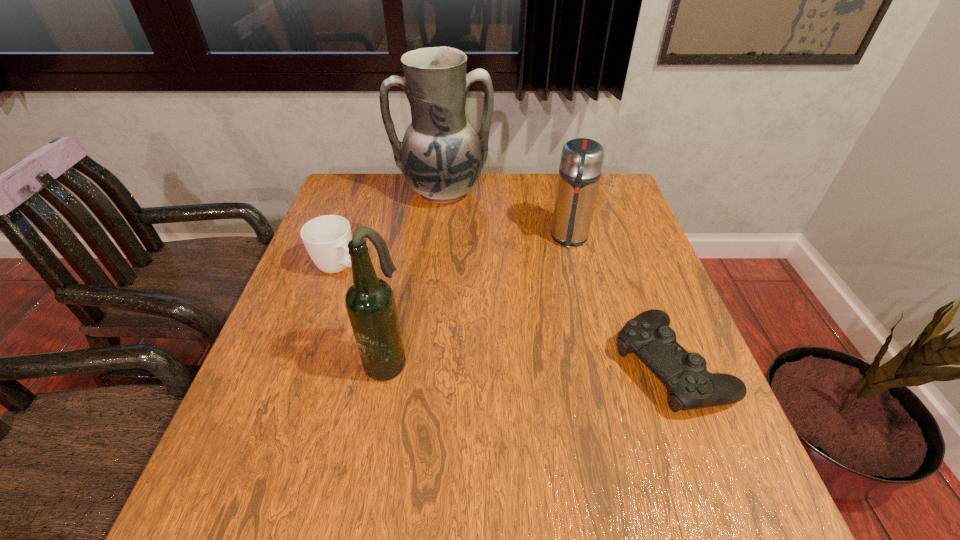
What are the coordinates of `object positioned at the left edge` in the screenshot? It's located at (x=326, y=238).

Where is `control positioned at the right edge`? The image size is (960, 540). control positioned at the right edge is located at coordinates (x=648, y=335).

Find the location of `thermos bottle that is at the right edge`. thermos bottle that is at the right edge is located at coordinates (581, 163).

Image resolution: width=960 pixels, height=540 pixels. I want to click on object that is at the near right corner, so click(x=648, y=335).

In the image, there is a desktop. Where is `vacant space at the far edge`? vacant space at the far edge is located at coordinates (414, 202).

This screenshot has height=540, width=960. Identify the location of vacant space at the near edge of the desktop. (332, 413).

Locate an element on the screen. The height and width of the screenshot is (540, 960). blank space at the left edge of the desktop is located at coordinates (343, 327).

Image resolution: width=960 pixels, height=540 pixels. In the image, there is a desktop. In order to click on vacant space at the right edge in this screenshot , I will do `click(618, 235)`.

I want to click on blank space at the far left corner, so click(x=386, y=178).

In the image, there is a desktop. At what (x,y) coordinates should I click in order to perform the action: click on vacant space at the near right corner. Please return your answer as a coordinate pair (x, y). This screenshot has width=960, height=540. Looking at the image, I should click on (732, 441).